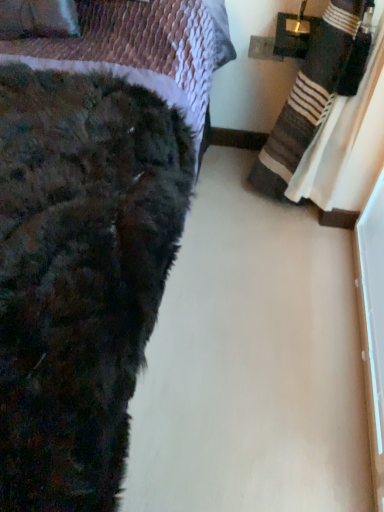
Question: Is point (362, 0) closer or farther from the camera than point (66, 33)?

Choices:
 (A) closer
 (B) farther

Answer: (A)

Question: Based on their positions, is striped cotton blanket at right located to the left or right of velvet purple throw pillow at upper left?

Choices:
 (A) left
 (B) right

Answer: (B)

Question: Which is farther from the fuzzy black blanket at lower left?

Choices:
 (A) striped cotton blanket at right
 (B) velvet purple throw pillow at upper left

Answer: (A)

Question: Considering the real-world distances, which object is farthest from the striped cotton blanket at right?

Choices:
 (A) velvet purple throw pillow at upper left
 (B) fuzzy black blanket at lower left

Answer: (A)